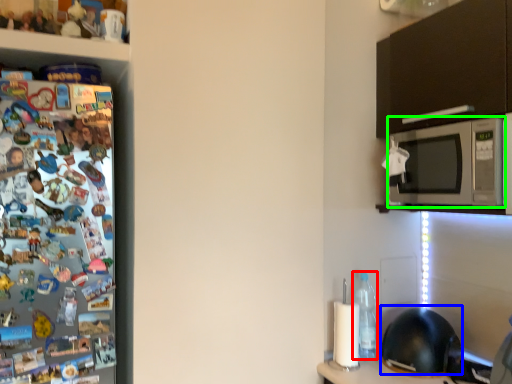
Question: Estimate the real-world distances between objects in this image. Which object is closer to bottle (highlighted by a red box), helmet (highlighted by a blue box) or microwave oven (highlighted by a green box)?

Choices:
 (A) helmet
 (B) microwave oven

Answer: (A)